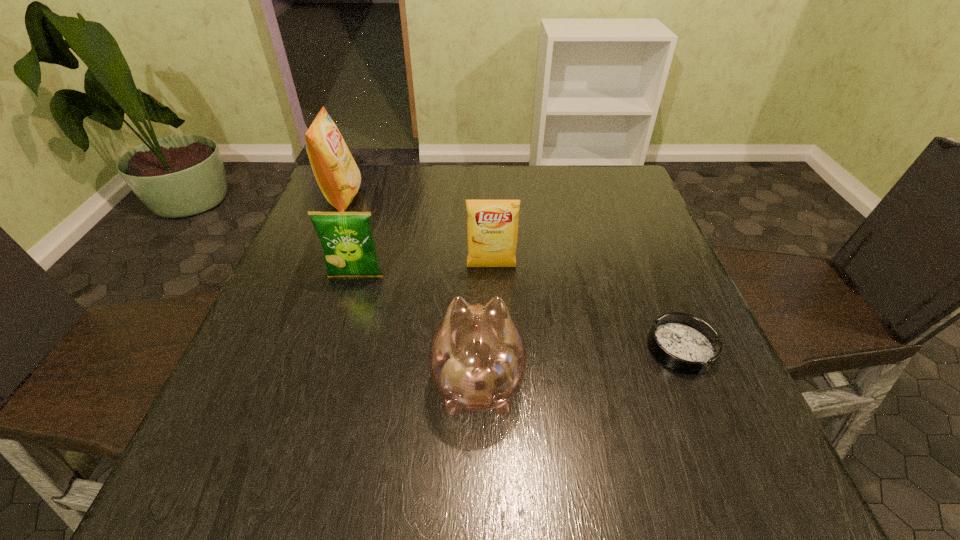
The image size is (960, 540). Find the location of `free point located 0.260m on the front facing side of the piggy bank`. free point located 0.260m on the front facing side of the piggy bank is located at coordinates (478, 254).

Where is `free spot located on the left of the ashtray`? free spot located on the left of the ashtray is located at coordinates (492, 348).

You are a GUI agent. You are given a task and a screenshot of the screen. Output one action in this format:
    pyautogui.click(x=<x>, y=<y>)
    Task: Click on the object that is at the far edge
    
    Given the screenshot: What is the action you would take?
    pyautogui.click(x=337, y=174)

The image size is (960, 540). Identify the location of object at the right edge. (685, 343).

This screenshot has height=540, width=960. In order to click on object situated at the far left corner in this screenshot , I will do `click(337, 174)`.

Find the location of `vacant space at the far edge`. vacant space at the far edge is located at coordinates (507, 189).

Locate an element on the screen. This screenshot has width=960, height=540. free location at the near edge of the desktop is located at coordinates (329, 500).

In the image, there is a desktop. Where is `free region at the left edge`? This screenshot has width=960, height=540. free region at the left edge is located at coordinates (326, 286).

The height and width of the screenshot is (540, 960). What are the coordinates of `free space at the right edge of the desktop` in the screenshot? It's located at (662, 287).

Identify the location of vacant area at the far left corner. This screenshot has height=540, width=960. (368, 166).